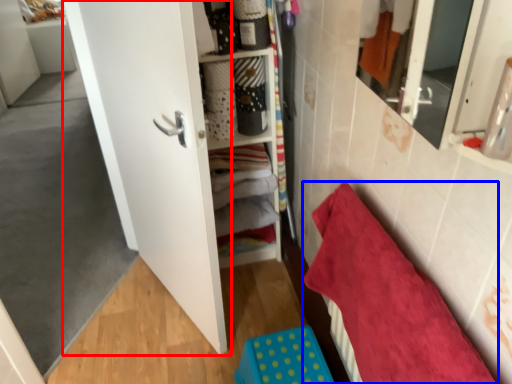
Question: Which point is further to the camera, door (highlighted by a red box) or towel (highlighted by a blue box)?

Choices:
 (A) door
 (B) towel

Answer: (A)